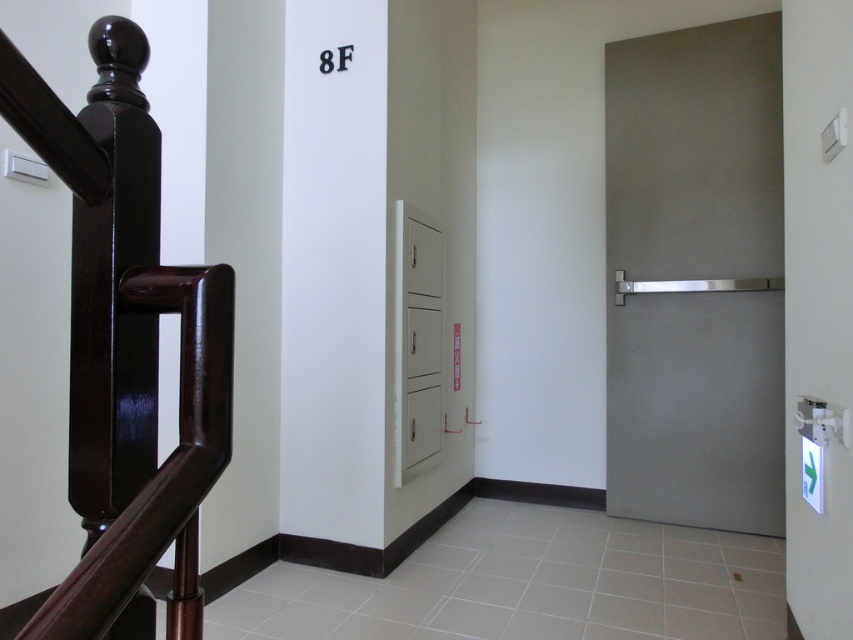
Does point (747, 454) lie behind point (405, 385)?

Yes, it is.

Between satin silver door at right and white matte cabinet at center, which one is positioned higher?

satin silver door at right

Between point (706, 150) and point (402, 323), which one is positioned behind?

The point (706, 150) is behind.

What are the coordinates of `satin silver door at right` in the screenshot? It's located at (695, 276).

Is satin silver door at right closer to camera compared to glossy wood handrail at left?

No, satin silver door at right is behind glossy wood handrail at left.

Can you confirm if satin silver door at right is taller than glossy wood handrail at left?

Correct, satin silver door at right is much taller as glossy wood handrail at left.

Where is `satin silver door at right`? This screenshot has height=640, width=853. satin silver door at right is located at coordinates (695, 276).

Identify the location of satin silver door at right. This screenshot has height=640, width=853. (695, 276).

This screenshot has height=640, width=853. What do you see at coordinates (126, 349) in the screenshot? I see `glossy wood handrail at left` at bounding box center [126, 349].

How far apart are glossy wood handrail at left and white matte cabinet at center?

The distance of glossy wood handrail at left from white matte cabinet at center is 6.26 feet.

What are the coordinates of `glossy wood handrail at left` in the screenshot? It's located at (126, 349).